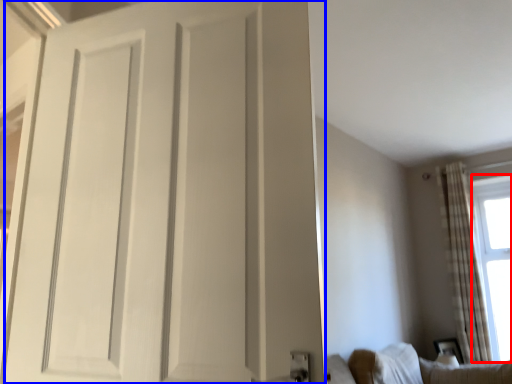
Question: Which object appears closest to the camera in this image, window screen (highlighted by a red box) or door (highlighted by a blue box)?

Choices:
 (A) window screen
 (B) door

Answer: (B)